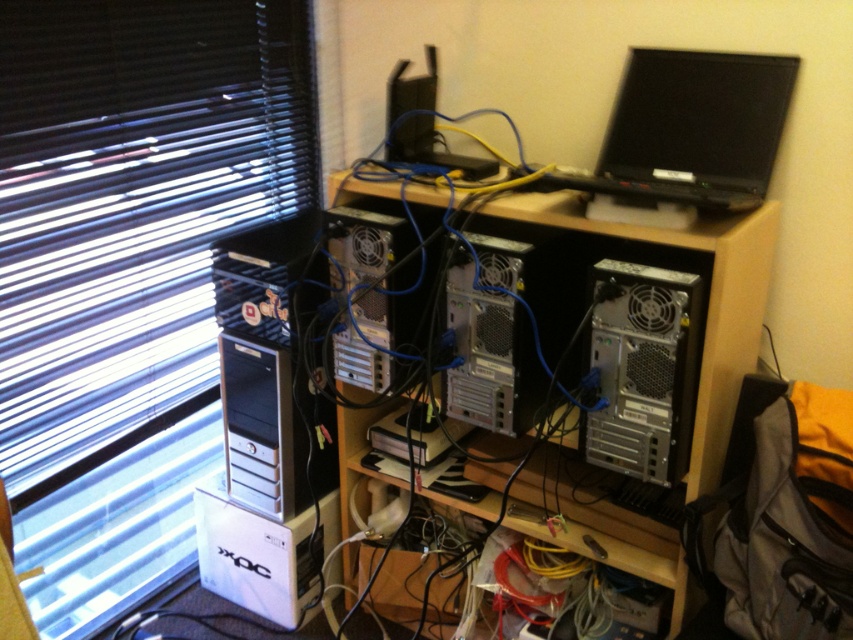
Question: Which point is closer to the camera?

Choices:
 (A) (663, 104)
 (B) (686, 369)
 (C) (195, 557)
 (D) (706, 465)

Answer: (B)

Question: Is black glossy laptop at upper right bigger than sleek silver tower at center?

Choices:
 (A) no
 (B) yes

Answer: (B)

Question: Among these objects, which one is nearest to the camera?

Choices:
 (A) sleek silver tower at center
 (B) black glossy laptop at upper right
 (C) silver metallic computer desk at center

Answer: (C)

Question: Where is black matte blinds at upper left located in relation to silver metallic computer desk at center in the image?

Choices:
 (A) above
 (B) below

Answer: (A)

Question: Considering the relative positions of silver metallic computer desk at center and sleek silver tower at center in the image provided, where is silver metallic computer desk at center located with respect to sleek silver tower at center?

Choices:
 (A) below
 (B) above

Answer: (B)

Question: Which point is closer to the camera?

Choices:
 (A) (126, 118)
 (B) (706, 77)
 (C) (692, 440)
 (D) (543, 301)

Answer: (C)